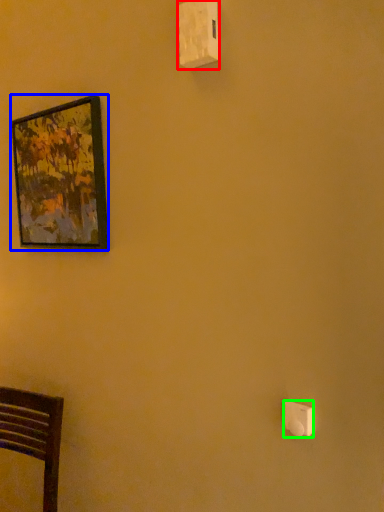
Question: Considering the real-world distances, which object is closest to light switch (highlighted by a red box)? picture frame (highlighted by a blue box) or light switch (highlighted by a green box).

Choices:
 (A) picture frame
 (B) light switch

Answer: (A)